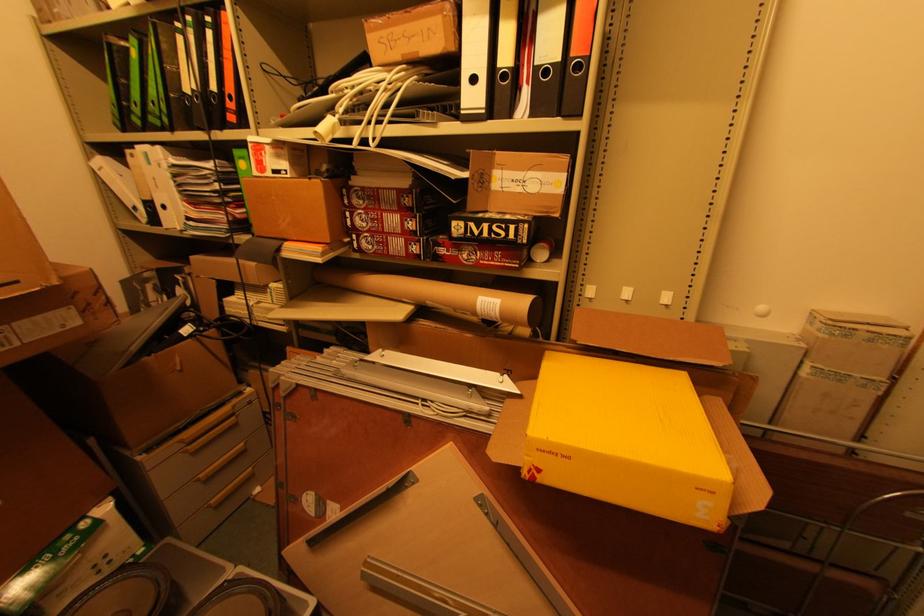
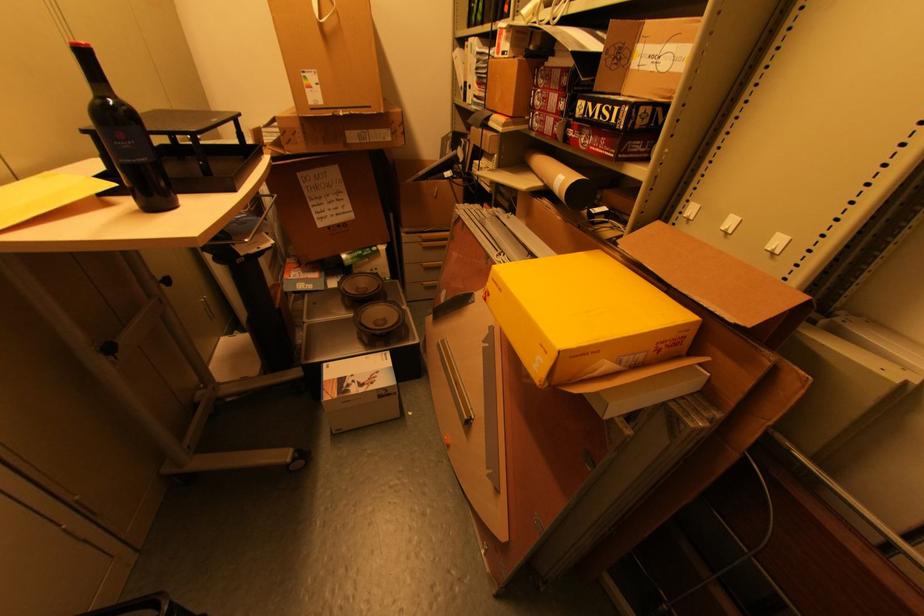
Locate, in the second image, the point that corresponds to [502,227] in the first image.

(610, 108)